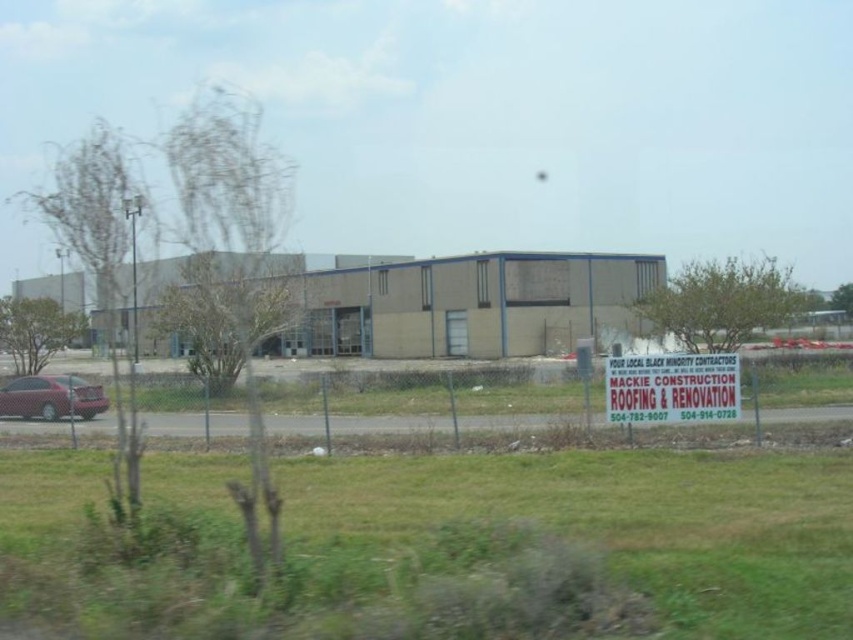
You are a delivery driver arriving at the Mackie Construction site. Your task is to park the matte red car at left in a spot that allows you to easily read the white paper sign at center from the driver seat. Given their relative sizes, which object should you position closer to ensure visibility?

The white paper sign at center is taller than the matte red car at left, so you should position the white paper sign at center closer to ensure its height doesn not block the view from the driver seat.

You are a delivery driver approaching the property and need to locate the white paper sign at center and the matte red car at left. Which object would appear larger in your view as you drive closer to the property?

The white paper sign at center would appear larger because it is closer to the viewer than the matte red car at left.

You are standing at the entrance of the building and want to check the distance to the white paper sign at center displayed on the fence. Can you estimate how far it is?

The white paper sign at center is 69.92 feet away from the camera, so the distance is approximately 70 feet.